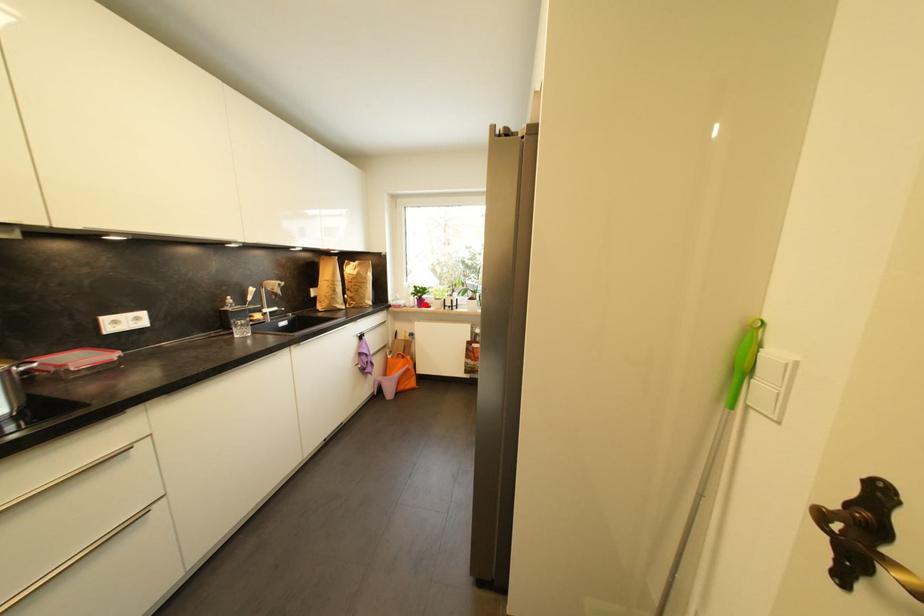
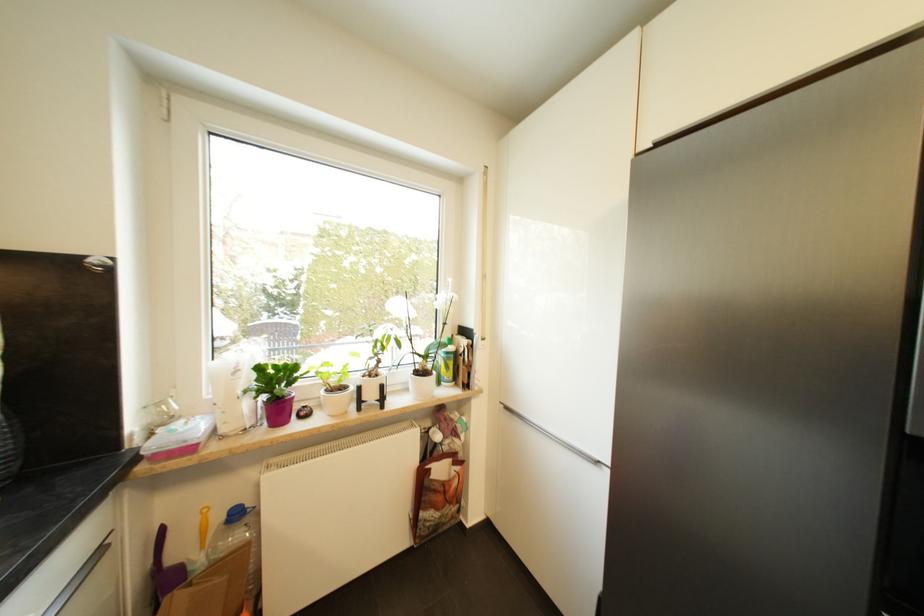
The point at the highlighted location is marked in the first image. Where is the corresponding point in the second image?

(285, 411)